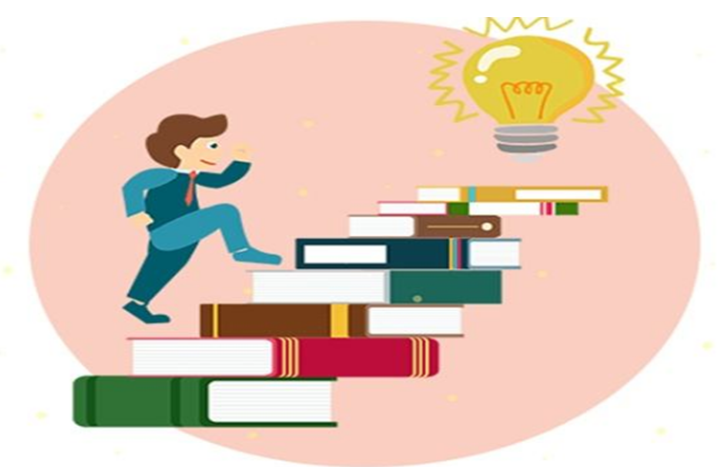
Find the location of `books`. books is located at coordinates (255, 367), (265, 385), (330, 318), (352, 240), (414, 221), (429, 212), (483, 196), (531, 216).